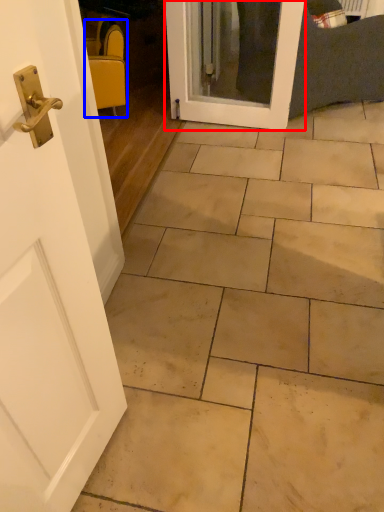
Question: Which point is closer to the camera, door (highlighted by a red box) or chair (highlighted by a blue box)?

Choices:
 (A) door
 (B) chair

Answer: (A)